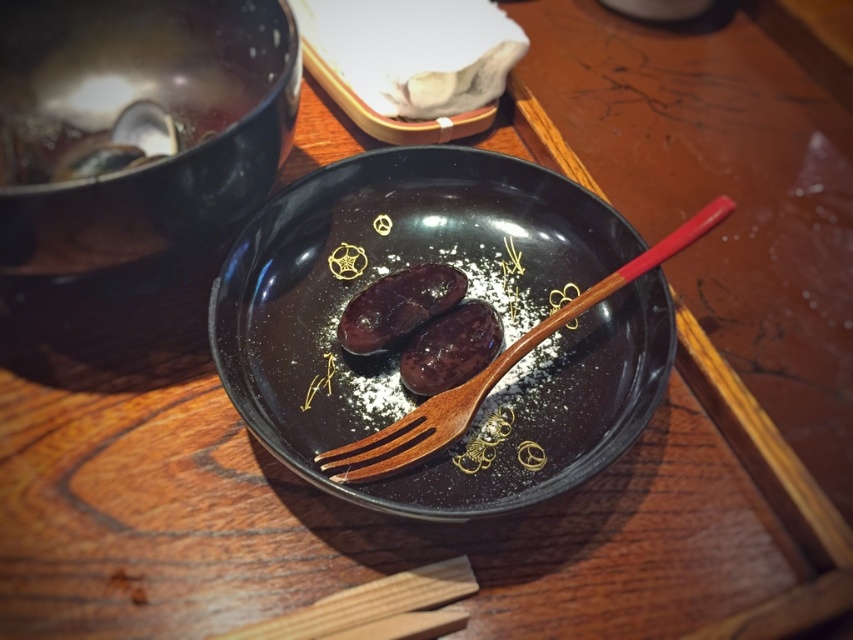
Does black matte plate at center lie in front of shiny dark brown meat at center?

Yes, black matte plate at center is closer to the viewer.

Can you confirm if black matte plate at center is shorter than shiny dark brown meat at center?

No, black matte plate at center is not shorter than shiny dark brown meat at center.

Identify the location of black matte plate at center. This screenshot has height=640, width=853. (469, 296).

Between point (65, 246) and point (448, 349), which one is positioned in front?

Positioned in front is point (65, 246).

Does glossy ceramic bowl at upper center have a lesser height compared to shiny dark brown dessert at center?

No, glossy ceramic bowl at upper center is not shorter than shiny dark brown dessert at center.

Is point (32, 268) closer to viewer compared to point (444, 317)?

That is True.

Where is `glossy ceramic bowl at upper center`? The height and width of the screenshot is (640, 853). glossy ceramic bowl at upper center is located at coordinates (126, 147).

Can you confirm if wooden chopsticks at lower center is positioned above shiny dark brown dessert at center?

No.

Is point (434, 564) in front of point (468, 344)?

Yes.

Locate an element on the screen. wooden chopsticks at lower center is located at coordinates (367, 602).